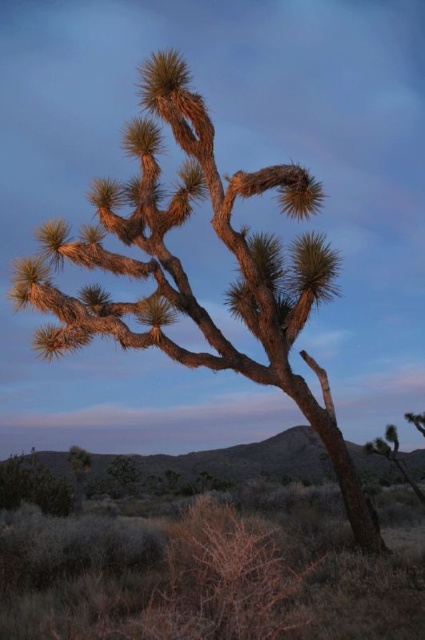
You are a hiker who wants to take a photo of both the brown rough bark tree at lower right and the brown rough bark tree at lower left. Which tree should you move closer to in order to capture both in the same frame?

You should move closer to the brown rough bark tree at lower right because it is in front of the brown rough bark tree at lower left, so positioning yourself closer to the front tree will help include both in the frame.